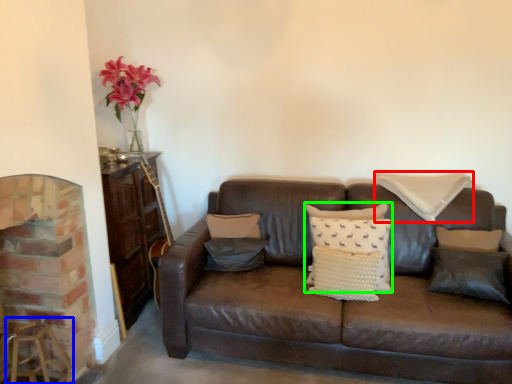
Question: Which is farther away from pillow (highlighted by a red box)? bar stool (highlighted by a blue box) or pillow (highlighted by a green box)?

Choices:
 (A) bar stool
 (B) pillow

Answer: (A)